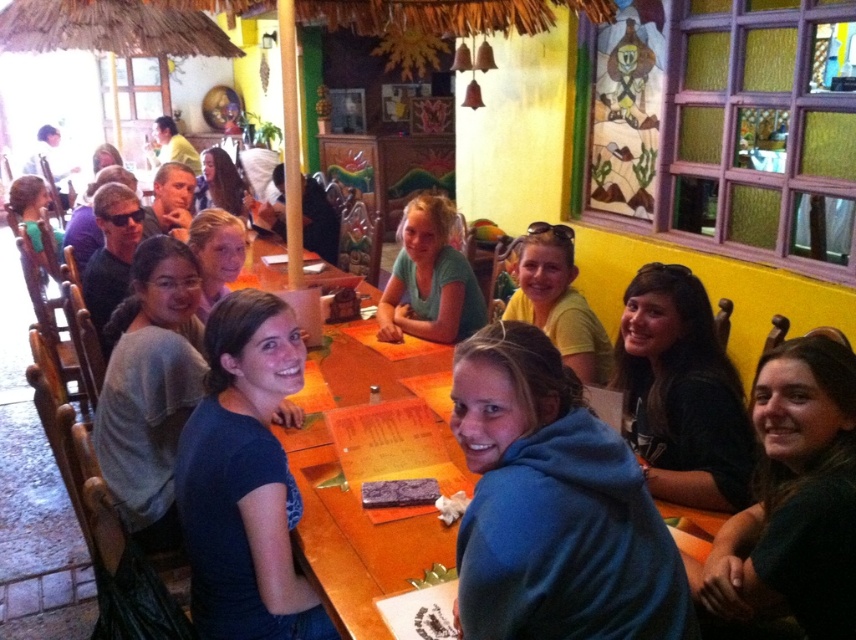
Question: Which point is closer to the camera?

Choices:
 (A) purple matte napkin at lower center
 (B) dark green hoodie at lower right
 (C) matte blue shirt at center

Answer: (B)

Question: Considering the real-world distances, which object is farthest from the dark brown leather jacket at lower right?

Choices:
 (A) matte black hair at center
 (B) matte blue shirt at center

Answer: (A)

Question: Can you confirm if matte green shirt at left is smaller than white paper napkin at lower center?

Choices:
 (A) yes
 (B) no

Answer: (B)

Question: Which object is the farthest from the green matte shirt at center?

Choices:
 (A) matte black hair at center
 (B) dark green hoodie at lower right
 (C) matte blue shirt at center

Answer: (A)

Question: Can you confirm if dark brown leather jacket at lower right is wider than gray cotton shirt at left?

Choices:
 (A) yes
 (B) no

Answer: (B)

Question: Observing the image, what is the correct spatial positioning of dark brown leather jacket at lower right in reference to matte blue shirt at center?

Choices:
 (A) below
 (B) above

Answer: (A)